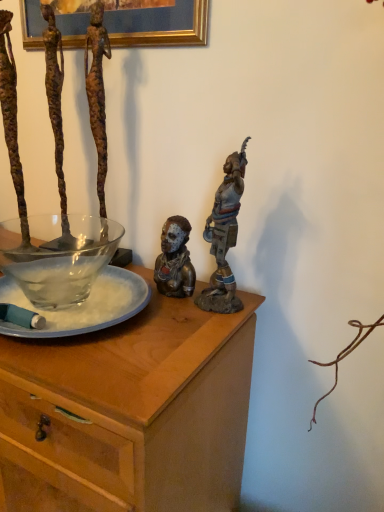
Locate an element on the screen. The height and width of the screenshot is (512, 384). bronze statue at upper right, the first person in the right-to-left sequence is located at coordinates (226, 224).

Measure the distance between wooden desk at center and camera.

They are 21.85 inches apart.

Describe the element at coordinates (175, 260) in the screenshot. The image size is (384, 512). I see `bronze statue at center, the 2th person in the right-to-left sequence` at that location.

In order to click on bronze statue at upper right, the first person in the right-to-left sequence in this screenshot , I will do `click(226, 224)`.

Which point is more distant from viewer, (66, 220) or (215, 215)?

Point (66, 220)

From a real-world perspective, is transparent glass bowl at left under bronze statue at upper right, which is counted as the 3th person, starting from the left?

Indeed, from a real-world perspective, transparent glass bowl at left is positioned beneath bronze statue at upper right, which is counted as the 3th person, starting from the left.

Are transparent glass bowl at left and bronze statue at upper right, which is counted as the 3th person, starting from the left, making contact?

transparent glass bowl at left and bronze statue at upper right, which is counted as the 3th person, starting from the left, are not in contact.

Who is shorter, transparent glass bowl at left or bronze statue at upper right, which is counted as the 3th person, starting from the left?

transparent glass bowl at left.

Is point (176, 288) positioned before point (96, 147)?

Yes.

Which object is further away from the camera taking this photo, bronze statue at center, placed as the 2th person when sorted from left to right, or rusty metal figure at upper left, acting as the first person starting from the left?

rusty metal figure at upper left, acting as the first person starting from the left, is further away from the camera.

Which object is positioned more to the left, bronze statue at center, the 2th person in the right-to-left sequence, or rusty metal figure at upper left, placed as the third person when sorted from right to left?

rusty metal figure at upper left, placed as the third person when sorted from right to left.

Considering the points (61, 335) and (229, 271), which point is behind, point (61, 335) or point (229, 271)?

The point (229, 271) is farther.

Who is more distant, clear glass plate at center or bronze statue at upper right, which is counted as the 3th person, starting from the left?

bronze statue at upper right, which is counted as the 3th person, starting from the left, is behind.

Is clear glass plate at center directly adjacent to bronze statue at upper right, the first person in the right-to-left sequence?

No, clear glass plate at center is not in contact with bronze statue at upper right, the first person in the right-to-left sequence.

From the image's perspective, is clear glass plate at center positioned above or below bronze statue at upper right, which is counted as the 3th person, starting from the left?

clear glass plate at center is below bronze statue at upper right, which is counted as the 3th person, starting from the left.

From a real-world perspective, is transparent glass bowl at left physically located above or below bronze statue at center, placed as the 2th person when sorted from left to right?

transparent glass bowl at left is situated lower than bronze statue at center, placed as the 2th person when sorted from left to right, in the real world.

Can you confirm if transparent glass bowl at left is taller than bronze statue at center, the 2th person in the right-to-left sequence?

In fact, transparent glass bowl at left may be shorter than bronze statue at center, the 2th person in the right-to-left sequence.

Is transparent glass bowl at left positioned beyond the bounds of bronze statue at center, the 2th person in the right-to-left sequence?

Yes, transparent glass bowl at left is located beyond the bounds of bronze statue at center, the 2th person in the right-to-left sequence.

In terms of size, does transparent glass bowl at left appear bigger or smaller than bronze statue at center, placed as the 2th person when sorted from left to right?

In the image, transparent glass bowl at left appears to be larger than bronze statue at center, placed as the 2th person when sorted from left to right.

Based on their positions, is clear glass plate at center located to the left or right of wooden desk at center?

In the image, clear glass plate at center appears on the right side of wooden desk at center.

From the image's perspective, is clear glass plate at center above wooden desk at center?

Indeed, from the image's perspective, clear glass plate at center is shown above wooden desk at center.

Locate an element on the screen. The image size is (384, 512). glass plate above the wooden desk at center (from a real-world perspective) is located at coordinates (83, 306).

Which object is wider, clear glass plate at center or wooden desk at center?

Wider between the two is wooden desk at center.

Which of these two, clear glass plate at center or rusty metal figure at upper left, acting as the first person starting from the left, stands shorter?

With less height is clear glass plate at center.

Which is in front, point (113, 317) or point (110, 52)?

Point (113, 317)

Is there a large distance between clear glass plate at center and rusty metal figure at upper left, placed as the third person when sorted from right to left?

clear glass plate at center is actually quite close to rusty metal figure at upper left, placed as the third person when sorted from right to left.

Who is more distant, clear glass plate at center or rusty metal figure at upper left, placed as the third person when sorted from right to left?

rusty metal figure at upper left, placed as the third person when sorted from right to left, is further from the camera.

Would you say wooden desk at center contains transparent glass bowl at left?

Actually, transparent glass bowl at left is outside wooden desk at center.

Could you tell me if wooden desk at center is turned towards transparent glass bowl at left?

No, wooden desk at center does not turn towards transparent glass bowl at left.

Is wooden desk at center next to transparent glass bowl at left?

wooden desk at center is not next to transparent glass bowl at left, and they're not touching.

Identify the location of bowl located behind the bronze statue at upper right, the first person in the right-to-left sequence. Image resolution: width=384 pixels, height=512 pixels. (57, 257).

At what (x,y) coordinates should I click in order to perform the action: click on person to the left of bronze statue at center, placed as the 2th person when sorted from left to right. Please return your answer as a coordinate pair (x, y). Looking at the image, I should click on click(97, 93).

From the picture: Considering their positions, is bronze statue at upper right, the first person in the right-to-left sequence, positioned further to wooden desk at center than clear glass plate at center?

The object further to wooden desk at center is bronze statue at upper right, the first person in the right-to-left sequence.

Looking at the image, which one is located closer to bronze statue at upper right, the first person in the right-to-left sequence, wooden desk at center or rusty metal figure at upper left, acting as the first person starting from the left?

Among the two, wooden desk at center is located nearer to bronze statue at upper right, the first person in the right-to-left sequence.

From the image, which object appears to be nearer to bronze statue at upper right, which is counted as the 3th person, starting from the left, clear glass plate at center or wooden desk at center?

clear glass plate at center is positioned closer to the anchor bronze statue at upper right, which is counted as the 3th person, starting from the left.

Based on their spatial positions, is wooden desk at center or rusty metal figure at upper left, placed as the third person when sorted from right to left, further from transparent glass bowl at left?

wooden desk at center is further to transparent glass bowl at left.

From the image, which object appears to be nearer to bronze statue at upper right, which is counted as the 3th person, starting from the left, transparent glass bowl at left or rusty metal figure at upper left, acting as the first person starting from the left?

rusty metal figure at upper left, acting as the first person starting from the left.

Based on the photo, based on their spatial positions, is bronze statue at upper right, which is counted as the 3th person, starting from the left, or wooden desk at center closer to clear glass plate at center?

wooden desk at center is positioned closer to the anchor clear glass plate at center.

Estimate the real-world distances between objects in this image. Which object is closer to rusty metal figure at upper left, acting as the first person starting from the left, wooden desk at center or bronze statue at upper right, the first person in the right-to-left sequence?

bronze statue at upper right, the first person in the right-to-left sequence.

Considering their positions, is transparent glass bowl at left positioned closer to rusty metal figure at upper left, acting as the first person starting from the left, than clear glass plate at center?

Among the two, transparent glass bowl at left is located nearer to rusty metal figure at upper left, acting as the first person starting from the left.

Locate an element on the screen. bowl situated between clear glass plate at center and bronze statue at upper right, the first person in the right-to-left sequence, from left to right is located at coordinates (57, 257).

Image resolution: width=384 pixels, height=512 pixels. I want to click on glass plate between rusty metal figure at upper left, placed as the third person when sorted from right to left, and wooden desk at center vertically, so click(x=83, y=306).

At what (x,y) coordinates should I click in order to perform the action: click on bowl located between clear glass plate at center and bronze statue at center, placed as the 2th person when sorted from left to right, in the left-right direction. Please return your answer as a coordinate pair (x, y). Looking at the image, I should click on (57, 257).

At what (x,y) coordinates should I click in order to perform the action: click on person between bronze statue at upper right, which is counted as the 3th person, starting from the left, and wooden desk at center vertically. Please return your answer as a coordinate pair (x, y). This screenshot has width=384, height=512. Looking at the image, I should click on (175, 260).